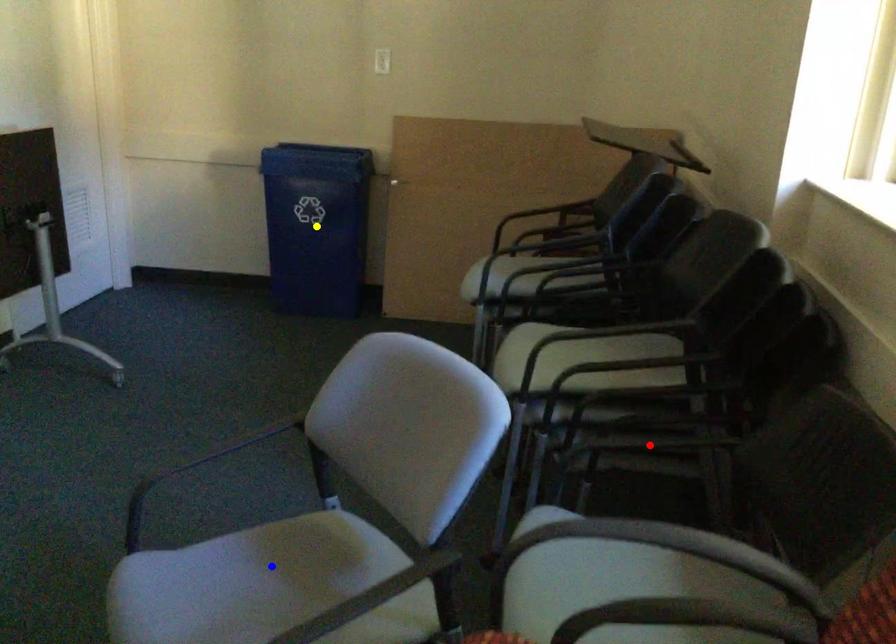
Order these from nearest to farthest:
- blue point
- red point
- yellow point

yellow point, red point, blue point